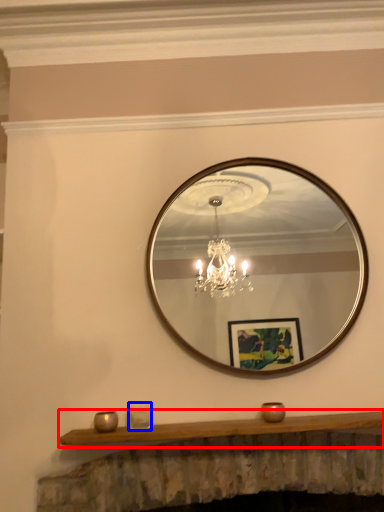
Question: Among these objects, which one is farthest to the camera, mantle (highlighted by a red box) or candle holder (highlighted by a blue box)?

Choices:
 (A) mantle
 (B) candle holder

Answer: (B)